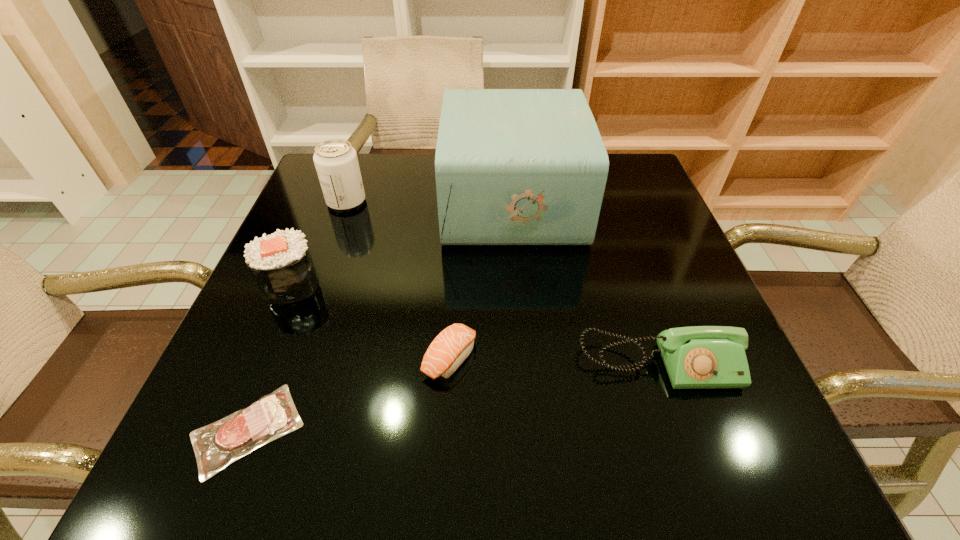
I want to click on free space located on the front panel of the tallest object, so click(423, 201).

Locate an element on the screen. The width and height of the screenshot is (960, 540). free location located on the front of the second tallest object is located at coordinates (314, 291).

Identify the location of vacant space located 0.380m on the right of the third tallest object. (511, 285).

This screenshot has height=540, width=960. I want to click on free region located on the dial of the fourth tallest object, so click(x=679, y=421).

I want to click on vacant space situated on the front of the shorter sushi, so click(446, 414).

This screenshot has height=540, width=960. I want to click on radio receiver present at the far edge, so click(513, 166).

Where is `soda can situated at the far edge`? The height and width of the screenshot is (540, 960). soda can situated at the far edge is located at coordinates 336,162.

The width and height of the screenshot is (960, 540). I want to click on object that is at the near edge, so click(x=217, y=445).

The image size is (960, 540). Find the location of `soda can positioned at the left edge`. soda can positioned at the left edge is located at coordinates (336, 162).

The width and height of the screenshot is (960, 540). I want to click on sushi that is at the left edge, so click(x=281, y=264).